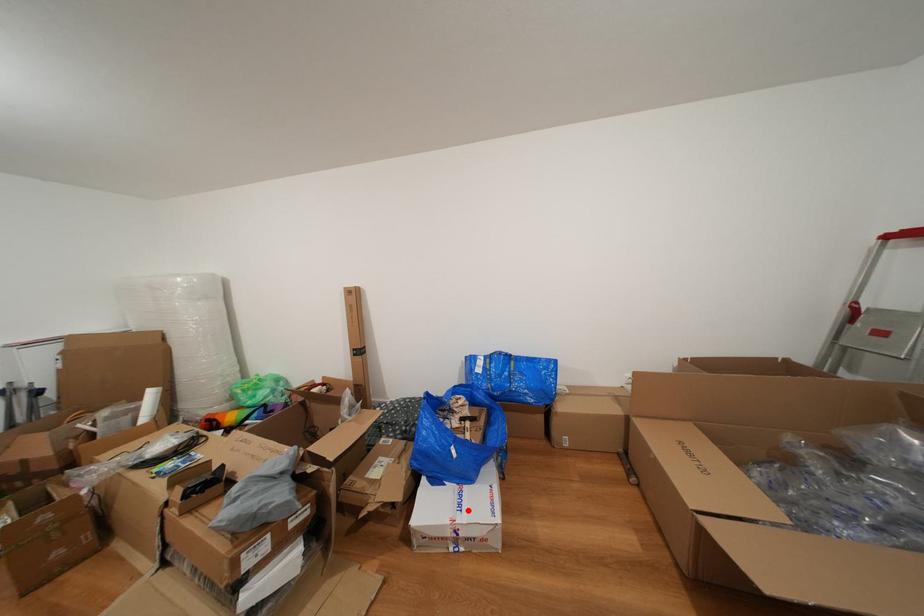
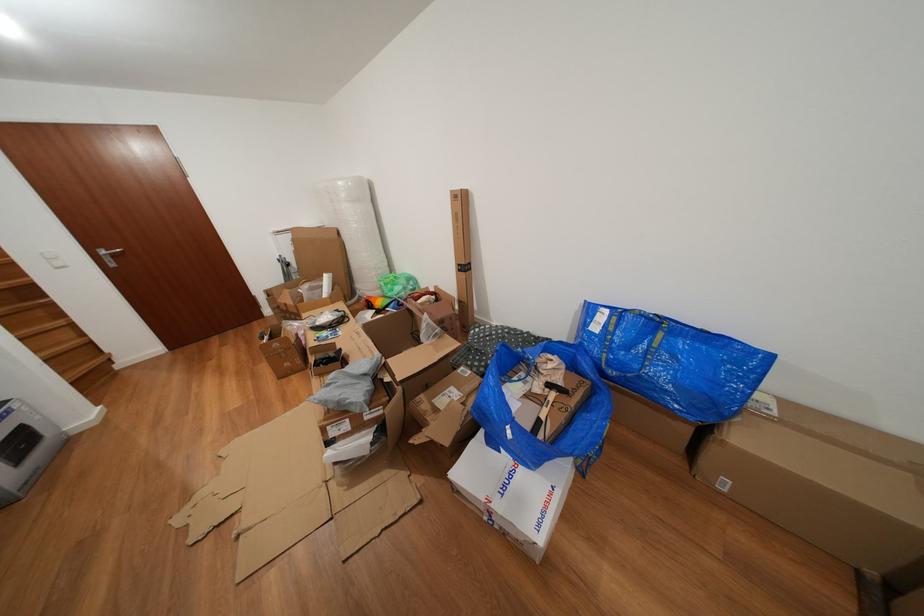
Question: I am providing you with two images of the same scene from different viewpoints. A red point is marked on the first image. At the location where the point appears in image 1, is it still visible in image 2?

Choices:
 (A) Yes
 (B) No

Answer: (A)